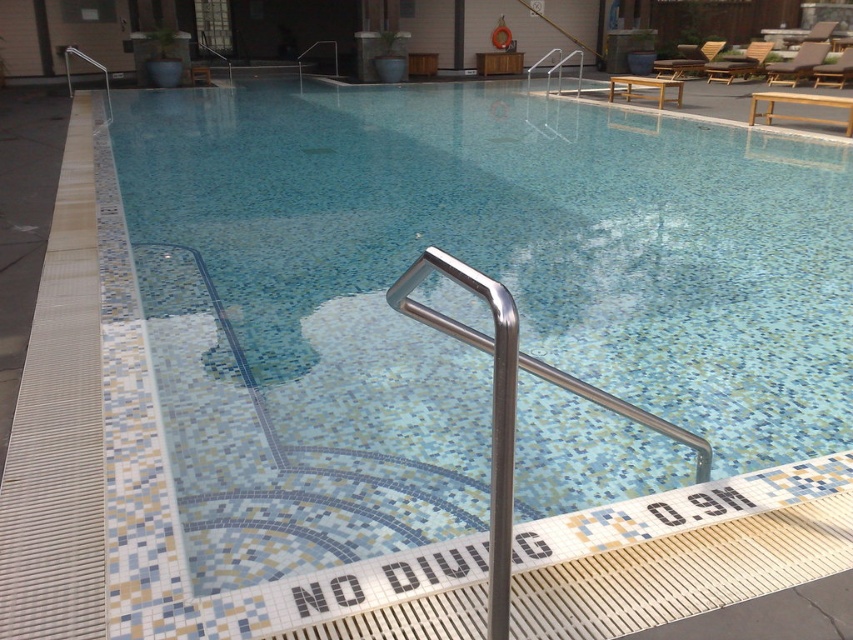
Between point (123, 150) and point (436, 268), which one is positioned behind?

Point (123, 150)

Who is more forward, (259, 99) or (462, 336)?

Point (462, 336) is in front.

This screenshot has width=853, height=640. I want to click on blue mosaic tile pool at center, so click(x=477, y=268).